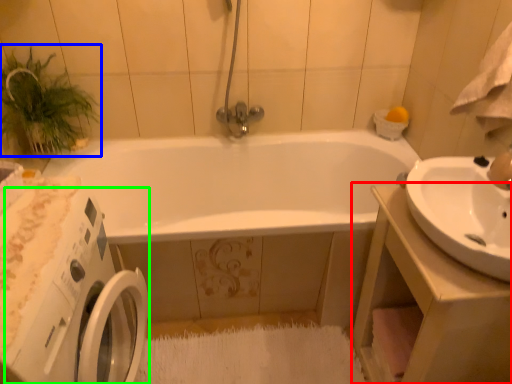
Question: Considering the real-world distances, which object is farthest from counter top (highlighted by a red box)? plant (highlighted by a blue box) or washing machine (highlighted by a green box)?

Choices:
 (A) plant
 (B) washing machine

Answer: (A)